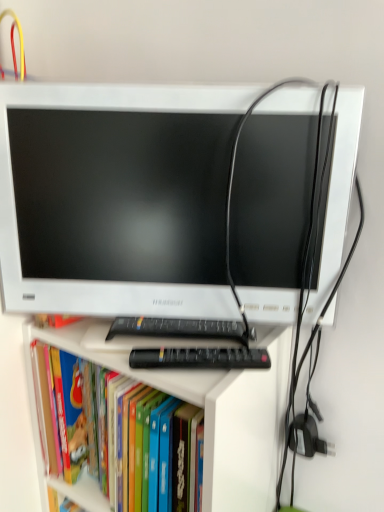
Question: Is white plastic computer monitor at center wider or thinner than hardcover book at center?

Choices:
 (A) thin
 (B) wide

Answer: (A)

Question: From a real-world perspective, is white plastic computer monitor at center physically located above or below hardcover book at center?

Choices:
 (A) above
 (B) below

Answer: (A)

Question: Which of these objects is positioned farthest from the black plastic keyboard at center?

Choices:
 (A) hardcover book at center
 (B) white plastic computer monitor at center

Answer: (A)

Question: Considering the real-world distances, which object is closest to the black plastic keyboard at center?

Choices:
 (A) white plastic computer monitor at center
 (B) hardcover book at center

Answer: (A)